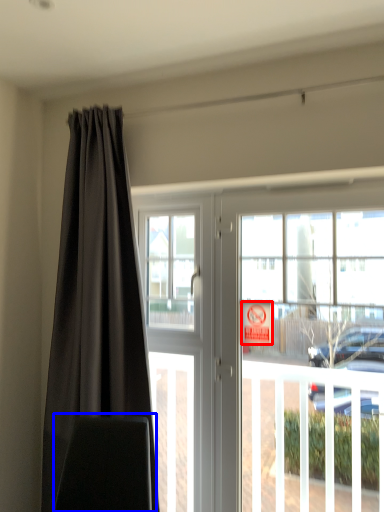
Question: Which point is further to the camera, parking sign (highlighted by a red box) or swivel chair (highlighted by a blue box)?

Choices:
 (A) parking sign
 (B) swivel chair

Answer: (A)